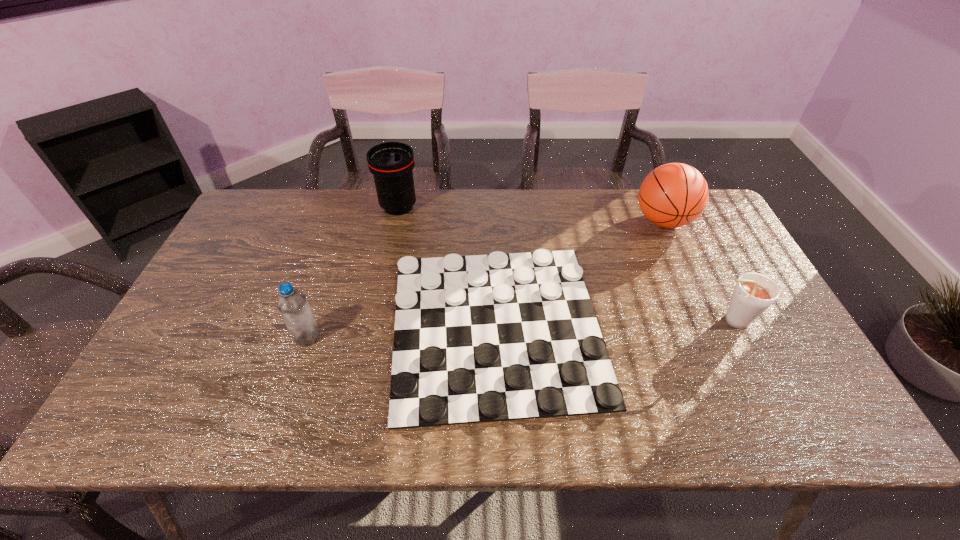
You are a GUI agent. You are given a task and a screenshot of the screen. Output one action in this format:
    pyautogui.click(x=<x>, y=<y>)
    Task: Click on the object that stands as the closest to the shortest object
    
    Given the screenshot: What is the action you would take?
    tap(391, 163)

Identify which object is located as the nearest to the root beer. Please provide its 2D coordinates. Your answer should be formatted as a tuple, i.e. [(x, y)], where the tuple contains the x and y coordinates of a point satisfying the conditions above.

[(673, 195)]

Identify the location of free location that satisfies the following two spatial constraints: 1. on the drink side of the root beer; 2. on the front side of the shortest object. coord(734,326).